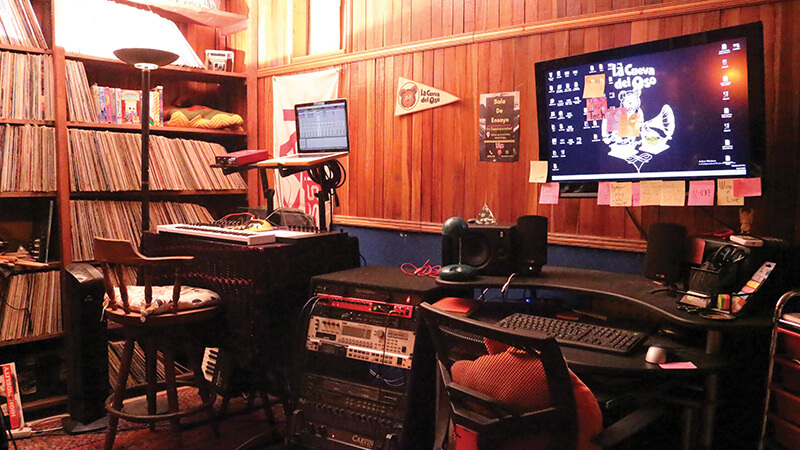
I want to click on black keyboare, so click(x=612, y=335).